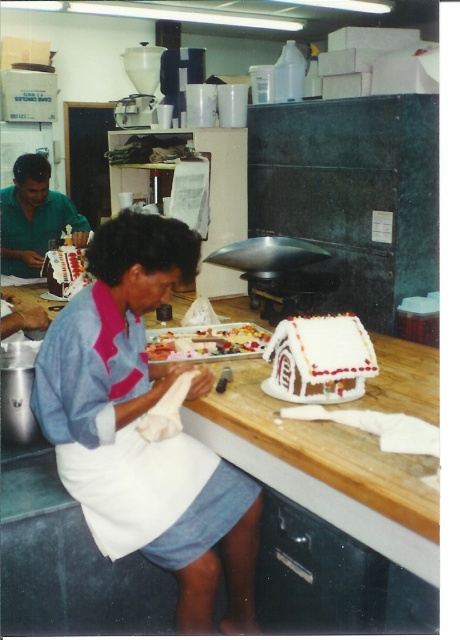
You are a chef who needs to grab the glazed sugar cookies at center while standing at the blue fabric shirt at center. Can you reach them without moving your body?

The blue fabric shirt at center and the glazed sugar cookies at center are 14.98 inches apart, which is within typical human reaching distance. Yes, you can reach the glazed sugar cookies at center without moving your body.

You are observing a kitchen scene where two people are making gingerbread houses. You need to determine the position of the blue fabric shirt at center relative to the wooden at center. Which object is located to the left?

The blue fabric shirt at center is positioned on the left side of wooden at center, so the blue fabric shirt at center is located to the left.